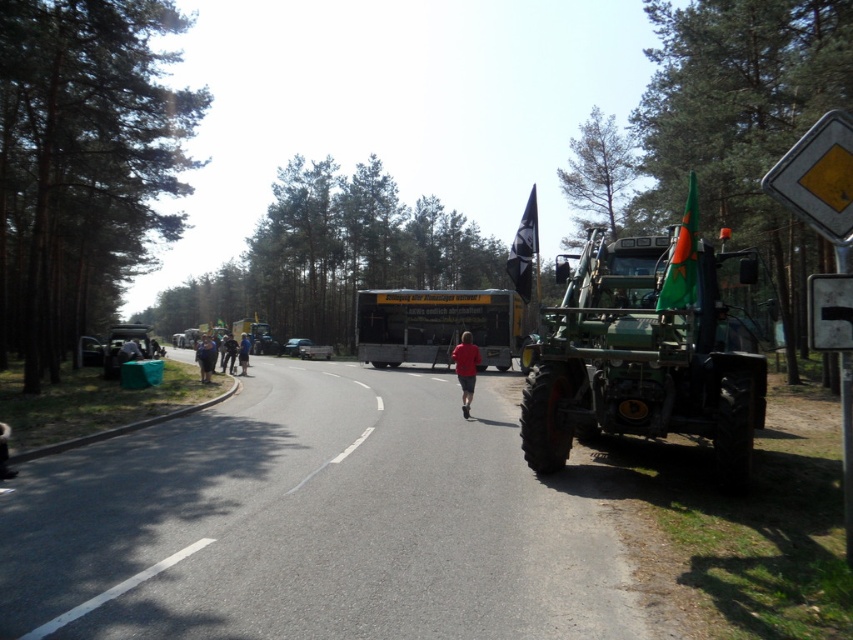
Between metallic silver trailer at left and red matte shirt at center, which one is positioned lower?

red matte shirt at center

Is metallic silver trailer at left closer to the viewer compared to red matte shirt at center?

That is False.

Where is `metallic silver trailer at left`? Image resolution: width=853 pixels, height=640 pixels. metallic silver trailer at left is located at coordinates (126, 346).

Does yellow matte truck at center appear on the left side of green fabric flag at right?

Yes, yellow matte truck at center is to the left of green fabric flag at right.

Between yellow matte truck at center and green fabric flag at right, which one is positioned lower?

yellow matte truck at center

Does point (416, 323) come closer to viewer compared to point (675, 298)?

No, it is behind (675, 298).

At what (x,y) coordinates should I click in order to perform the action: click on yellow matte truck at center. Please return your answer as a coordinate pair (x, y). The image size is (853, 640). Looking at the image, I should click on (437, 324).

Is blue denim jeans at center taller than blue denim jeans at left?

No.

Who is shorter, blue denim jeans at center or blue denim jeans at left?

blue denim jeans at center

This screenshot has height=640, width=853. Identify the location of blue denim jeans at center. pyautogui.click(x=228, y=353).